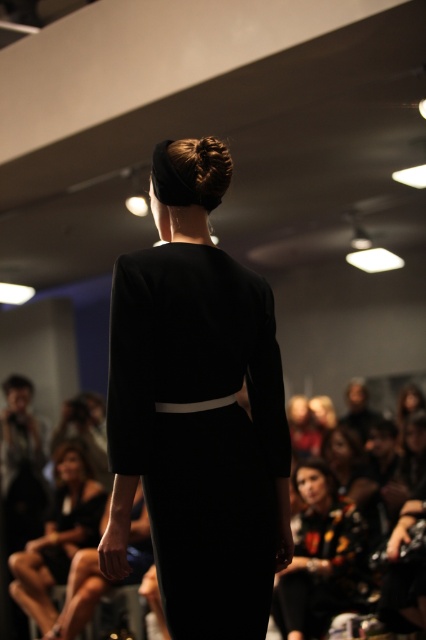
You are a photographer positioned at the runway end. You need to capture a photo that includes both the black satin dress at center and the matte black dress at center. Given that your camera has a maximum focus range of 3 meters, will you be able to capture both dresses in focus?

The black satin dress at center is 3.81 meters away from the matte black dress at center. Since the distance between them exceeds the camera maximum focus range of 3 meters, the camera cannot focus on both dresses simultaneously.

You are standing at point (x=311, y=506) and want to walk to the runway. The runway is 4.77 meters away from you. Is the runway in front of you or behind you?

The runway is in front of you because it is 4.77 meters away from the point (x=311, y=506), which is the direction you are facing.